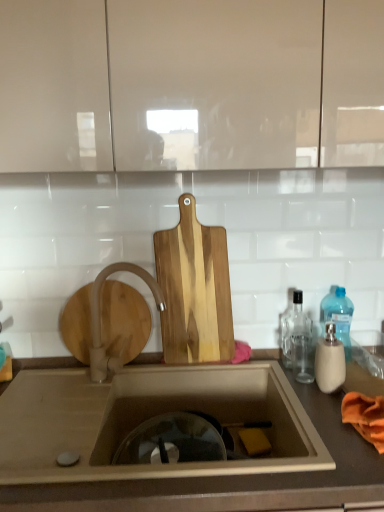
You are a GUI agent. You are given a task and a screenshot of the screen. Output one action in this format:
    pyautogui.click(x=<x>, y=<y>)
    Task: Click on the vacant area in front of beige matte soap dispenser at right, marked as the third bottle in a back-to-front arrangement
    
    Given the screenshot: What is the action you would take?
    pyautogui.click(x=324, y=420)